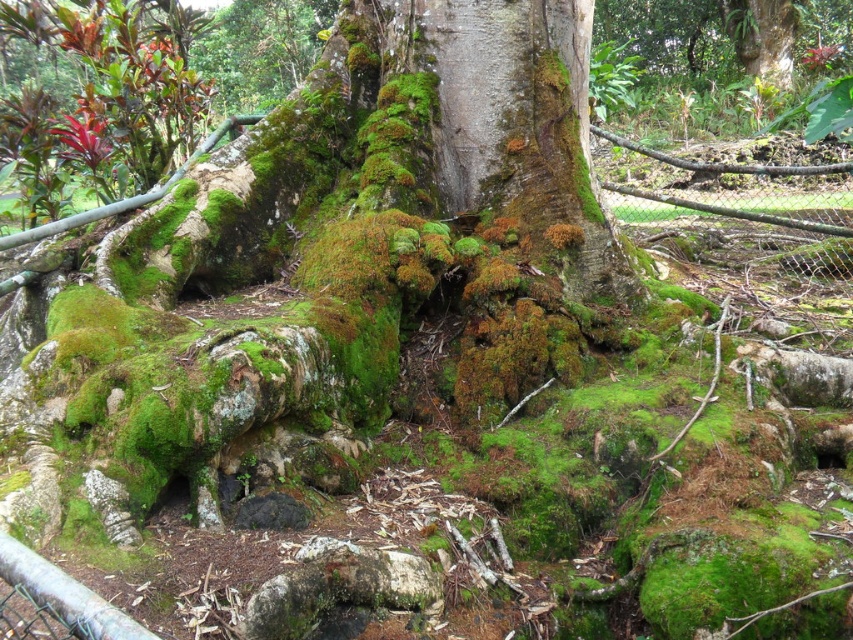
Question: Is green mossy bark at center to the left of wire mesh fence at lower right from the viewer's perspective?

Choices:
 (A) no
 (B) yes

Answer: (B)

Question: Which point appears closest to the camera in this image?

Choices:
 (A) (837, 176)
 (B) (525, 196)

Answer: (B)

Question: Can you confirm if green mossy bark at center is positioned to the right of wire mesh fence at lower right?

Choices:
 (A) no
 (B) yes

Answer: (A)

Question: Which object appears farthest from the camera in this image?

Choices:
 (A) green mossy bark at center
 (B) wire mesh fence at lower right

Answer: (B)

Question: Can you confirm if green mossy bark at center is positioned above wire mesh fence at lower right?

Choices:
 (A) no
 (B) yes

Answer: (A)

Question: Which point is closer to the camera?

Choices:
 (A) green mossy bark at center
 (B) wire mesh fence at lower right

Answer: (A)